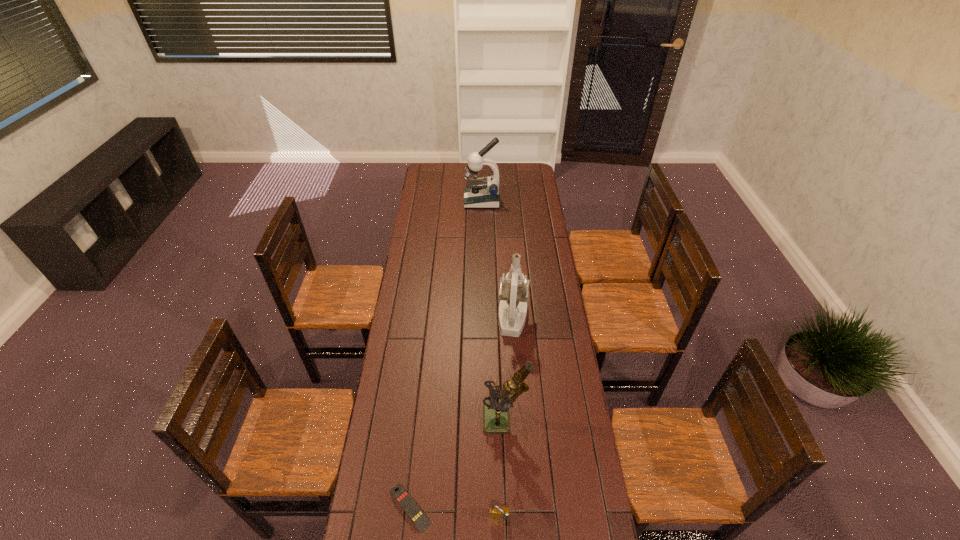
Locate an element on the screen. free space located 0.250m at the eyepiece of the third farthest object is located at coordinates (414, 420).

The width and height of the screenshot is (960, 540). In order to click on free location located 0.300m at the eyepiece of the third farthest object in this screenshot , I will do `click(400, 420)`.

I want to click on vacant area situated at the eyepiece of the third farthest object, so click(x=383, y=420).

Find the location of `free spot located 0.310m on the back of the remote control`. free spot located 0.310m on the back of the remote control is located at coordinates (421, 398).

Locate an element on the screen. The width and height of the screenshot is (960, 540). object present at the left edge is located at coordinates (410, 507).

I want to click on object that is at the right edge, so click(514, 288).

This screenshot has width=960, height=540. Identify the location of free spot at the far edge of the desktop. (463, 183).

Locate an element on the screen. free space at the left edge of the desktop is located at coordinates (426, 227).

Identify the location of vacant space at the right edge. (518, 217).

The width and height of the screenshot is (960, 540). In the image, there is a desktop. Identify the location of free space at the far left corner. (441, 172).